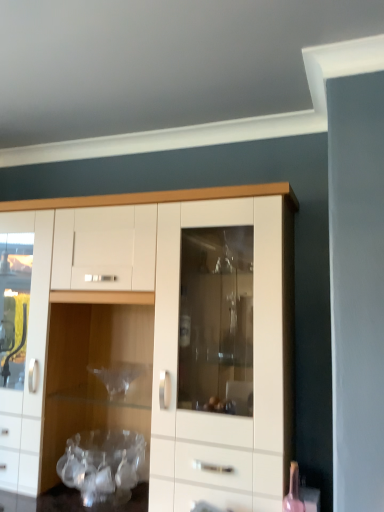
Question: Should I look upward or downward to see white glossy cupboard at center?

Choices:
 (A) up
 (B) down

Answer: (B)